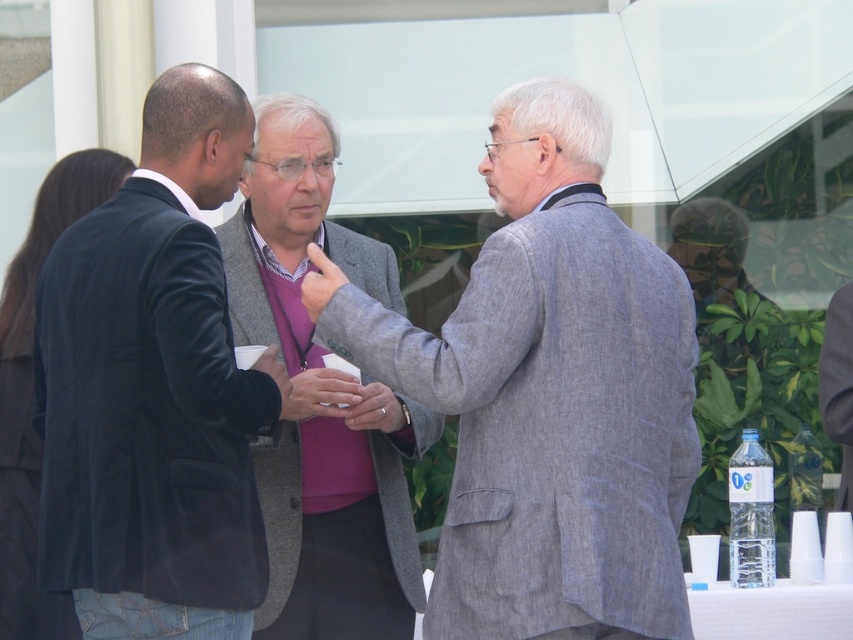
Question: Does velvet black blazer at left appear on the right side of matte pink sweater at center?

Choices:
 (A) yes
 (B) no

Answer: (B)

Question: Does gray textured suit at center have a larger size compared to velvet black blazer at left?

Choices:
 (A) no
 (B) yes

Answer: (B)

Question: Which point is closer to the camera?

Choices:
 (A) (303, 285)
 (B) (170, 477)
 (C) (561, 612)

Answer: (B)

Question: Which point is closer to the camera taking this photo?

Choices:
 (A) (332, 273)
 (B) (265, 502)

Answer: (A)

Question: Among these objects, which one is farthest from the camera?

Choices:
 (A) smooth gray hand at center
 (B) gray textured suit at center
 (C) gray woolen blazer at center

Answer: (C)

Question: Considering the relative positions of gray textured suit at center and smooth gray hand at center in the image provided, where is gray textured suit at center located with respect to smooth gray hand at center?

Choices:
 (A) right
 (B) left

Answer: (A)